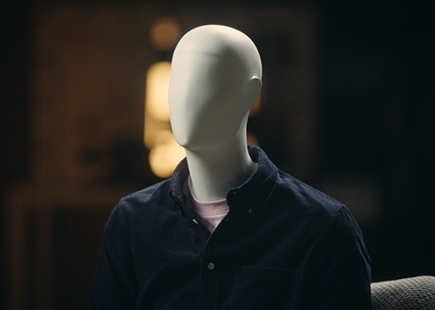
The width and height of the screenshot is (435, 310). What are the coordinates of `wall` in the screenshot? It's located at (100, 94).